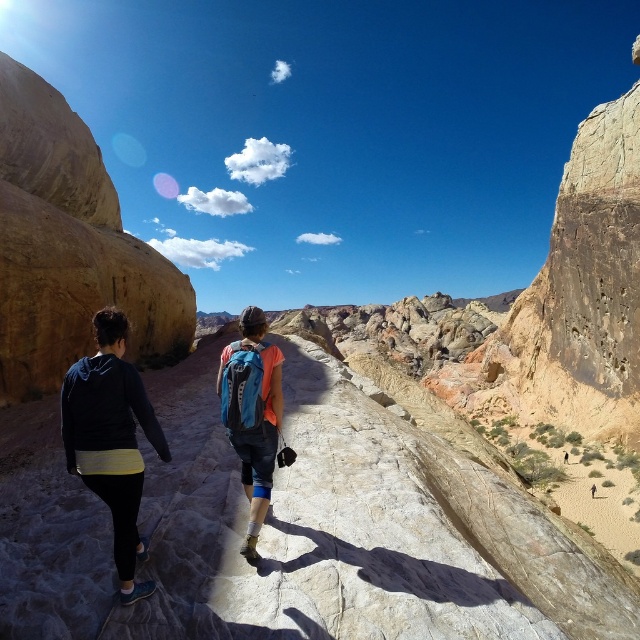
Consider the image. Between dark blue fleece at center and blue fabric backpack at center, which one appears on the right side from the viewer's perspective?

From the viewer's perspective, blue fabric backpack at center appears more on the right side.

Which is more to the left, dark blue fleece at center or blue fabric backpack at center?

Positioned to the left is dark blue fleece at center.

Between point (83, 428) and point (260, 404), which one is positioned behind?

Point (260, 404)

Identify the location of dark blue fleece at center. (112, 440).

Can you confirm if matte blue backpack at center is positioned above dark blue fleece at center?

Yes, matte blue backpack at center is above dark blue fleece at center.

Between matte blue backpack at center and dark blue fleece at center, which one has less height?

Standing shorter between the two is dark blue fleece at center.

Is point (93, 358) behind point (113, 400)?

Yes, it is.

I want to click on matte blue backpack at center, so click(112, 440).

Who is positioned more to the right, matte blue backpack at center or blue fabric backpack at center?

blue fabric backpack at center is more to the right.

Which is in front, point (76, 451) or point (259, 381)?

Point (76, 451) is in front.

Where is `matte blue backpack at center`? The image size is (640, 640). matte blue backpack at center is located at coordinates (112, 440).